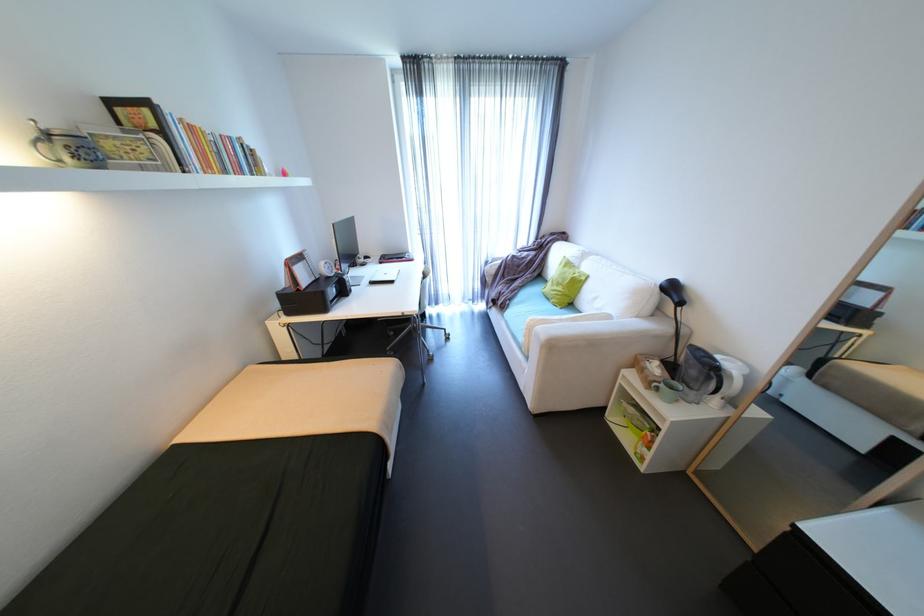
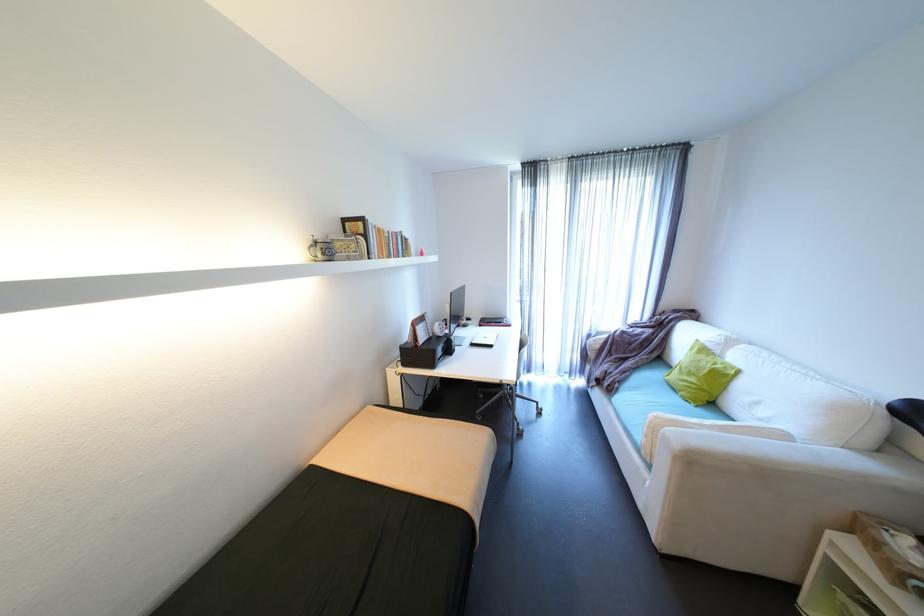
Locate, in the second image, the point that corresponds to the point at 410,257 in the first image.

(508, 323)